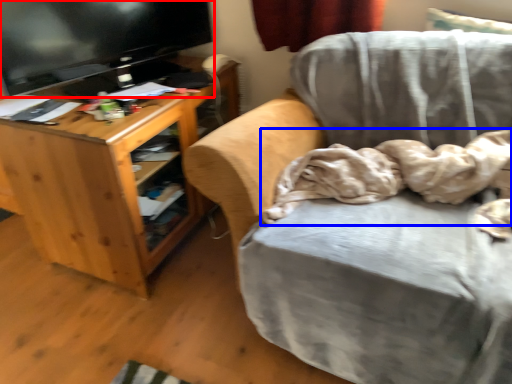
Question: Which point is closer to the camera, television (highlighted by a red box) or blanket (highlighted by a blue box)?

Choices:
 (A) television
 (B) blanket

Answer: (B)